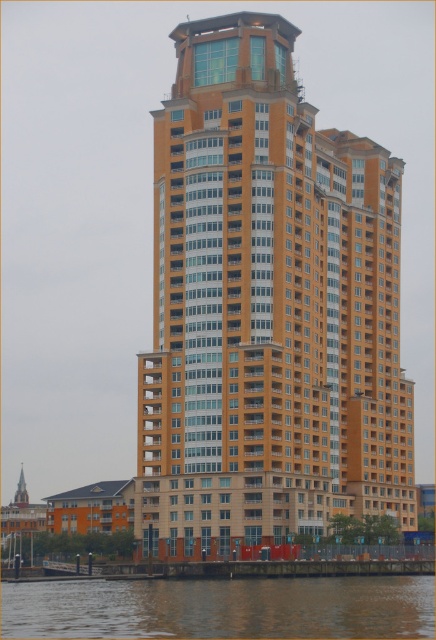
Who is more forward, (289, 228) or (398, 628)?

Positioned in front is point (398, 628).

Between orange glassy building at center and brown water at lower center, which one is positioned lower?

Positioned lower is brown water at lower center.

Is point (279, 208) closer to camera compared to point (422, 621)?

No, (279, 208) is further to viewer.

The image size is (436, 640). I want to click on orange glassy building at center, so click(x=266, y=308).